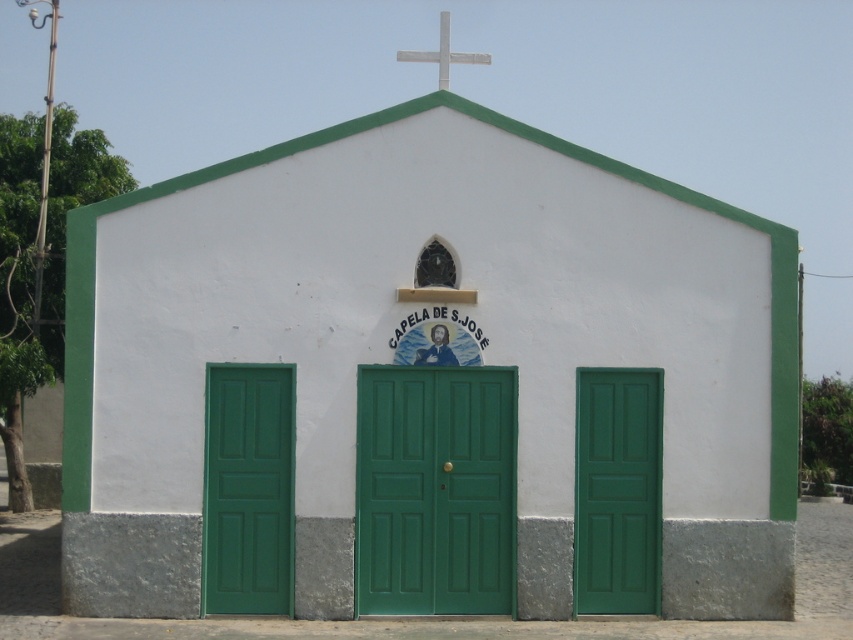
Question: Observing the image, what is the correct spatial positioning of green matte door at center in reference to green matte door at left?

Choices:
 (A) right
 (B) left

Answer: (A)

Question: Can you confirm if green matte door at center is positioned above white metallic cross at upper center?

Choices:
 (A) no
 (B) yes

Answer: (A)

Question: Which object is the farthest from the white metallic cross at upper center?

Choices:
 (A) green matte door at right
 (B) green matte door at left

Answer: (B)

Question: Does green matte door at center come in front of green matte door at left?

Choices:
 (A) yes
 (B) no

Answer: (B)

Question: Which point is closer to the camera?

Choices:
 (A) (282, 371)
 (B) (486, 380)
 (C) (416, 58)
 (D) (625, 445)

Answer: (A)

Question: Among these objects, which one is farthest from the camera?

Choices:
 (A) green matte door at center
 (B) white metallic cross at upper center
 (C) green matte door at right
 (D) green matte door at left

Answer: (B)